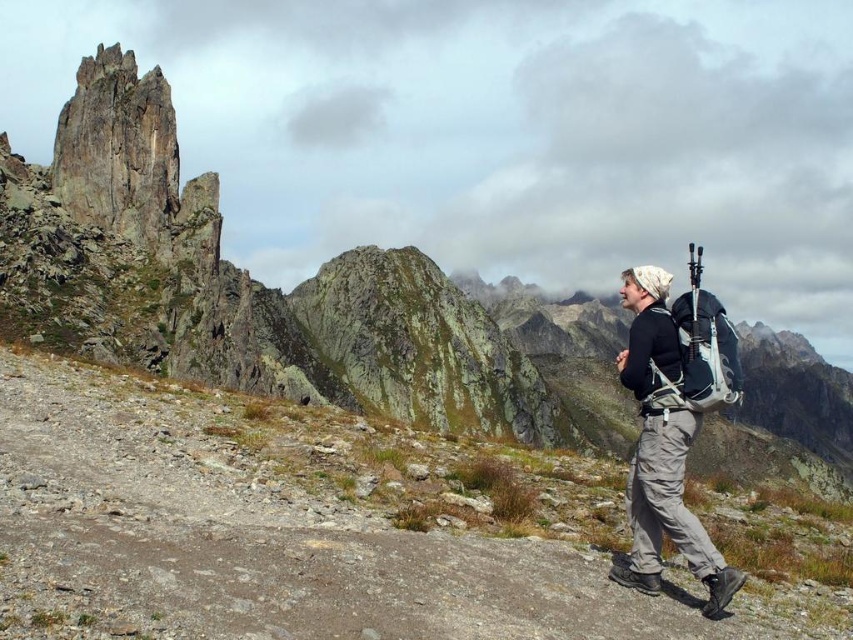
Is dull gray gravel at center behind matte black backpack at right?

No, dull gray gravel at center is closer to the viewer.

Is dull gray gravel at center positioned before matte black backpack at right?

Yes, dull gray gravel at center is closer to the viewer.

You are a GUI agent. You are given a task and a screenshot of the screen. Output one action in this format:
    pyautogui.click(x=<x>, y=<y>)
    Task: Click on the dull gray gravel at center
    The height and width of the screenshot is (640, 853).
    Given the screenshot: What is the action you would take?
    pyautogui.click(x=312, y=529)